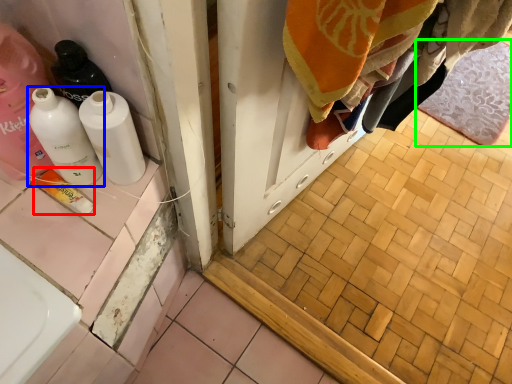
Question: Which object is the farthest from product (highlighted by a red box)? Choose among these: bottle (highlighted by a blue box) or bath mat (highlighted by a green box).

Choices:
 (A) bottle
 (B) bath mat

Answer: (B)